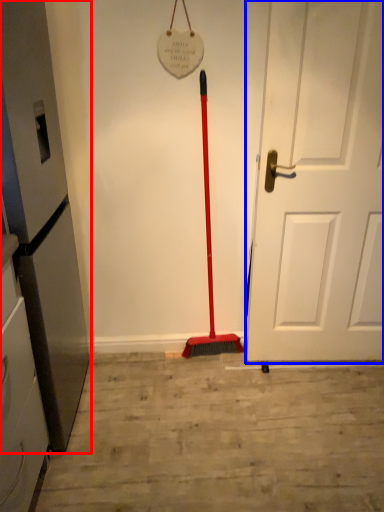
Question: Which point is further to the camera, appliance (highlighted by a red box) or door (highlighted by a blue box)?

Choices:
 (A) appliance
 (B) door

Answer: (B)